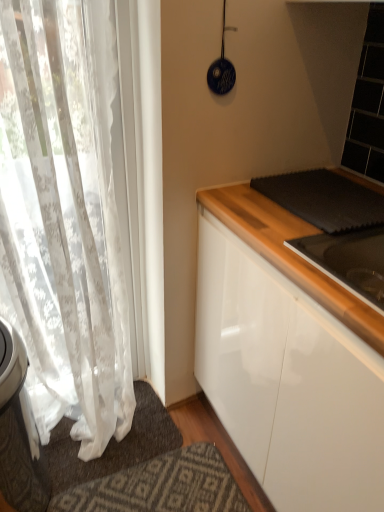
The width and height of the screenshot is (384, 512). What are the coordinates of `vacant point above white fabric doormat at lower left (from a real-world perspective)` in the screenshot? It's located at (107, 439).